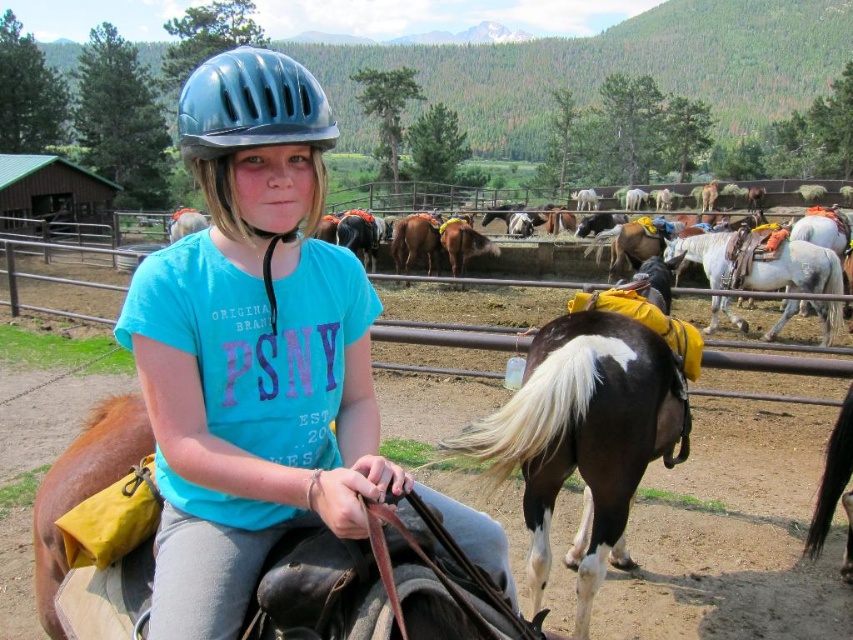
In the scene shown: Between white glossy horse at center and brown glossy horse at lower right, which one has less height?

brown glossy horse at lower right

Is point (822, 282) less distant than point (840, 474)?

No.

Where is `white glossy horse at center`? white glossy horse at center is located at coordinates (796, 269).

The height and width of the screenshot is (640, 853). I want to click on white glossy horse at center, so click(796, 269).

Consider the image. Does brown glossy horse at center have a greater height compared to matte blue helmet at upper center?

Indeed, brown glossy horse at center has a greater height compared to matte blue helmet at upper center.

Can you confirm if brown glossy horse at center is positioned below matte blue helmet at upper center?

Correct, brown glossy horse at center is located below matte blue helmet at upper center.

Which is behind, point (553, 381) or point (213, 202)?

The point (553, 381) is more distant.

In order to click on brown glossy horse at center in this screenshot , I will do `click(584, 436)`.

In the scene shown: Who is positioned more to the left, matte blue helmet at center or brown glossy horse at center?

From the viewer's perspective, matte blue helmet at center appears more on the left side.

Is point (190, 408) in front of point (595, 333)?

Yes, point (190, 408) is closer to viewer.

Who is more forward, (286,362) or (648,426)?

Point (286,362)

Where is `matte blue helmet at center`? matte blue helmet at center is located at coordinates (260, 355).